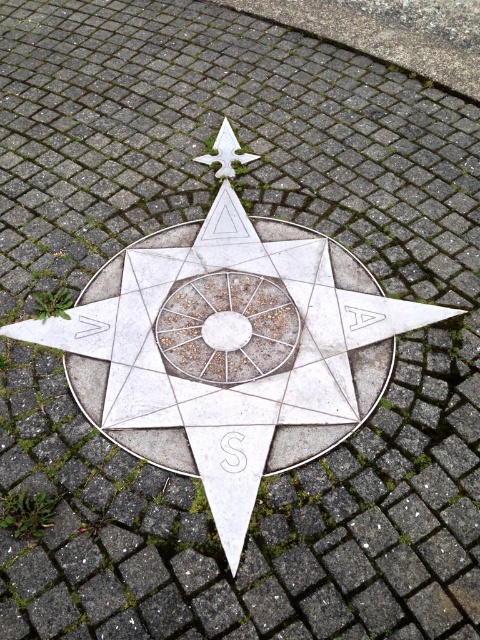
You are standing in front of the compass rose and want to place a small decorative stone between the metallic textured circle at center and the white metal star at upper center. Can you determine which object you should place the stone closer to in order to ensure it is equidistant from both?

The metallic textured circle at center is closer to the viewer than the white metal star at upper center, so to place the stone equidistant from both, it should be positioned closer to the white metal star at upper center.

You are standing on the paved surface where the compass rose is located. You see the metallic textured circle at center and the white metal star at upper center. Which object is closer to your feet?

The metallic textured circle at center is closer to your feet because it is positioned under the white metal star at upper center.